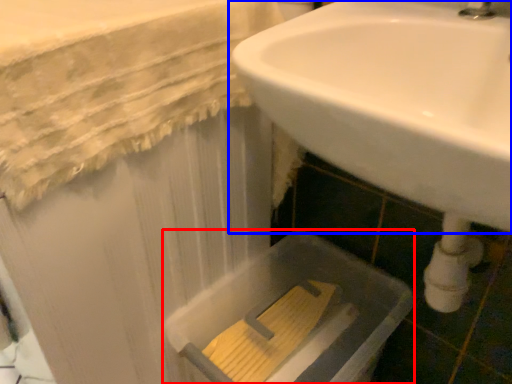
Question: Which object appears closest to the camera in this image, bath (highlighted by a red box) or sink (highlighted by a blue box)?

Choices:
 (A) bath
 (B) sink

Answer: (B)